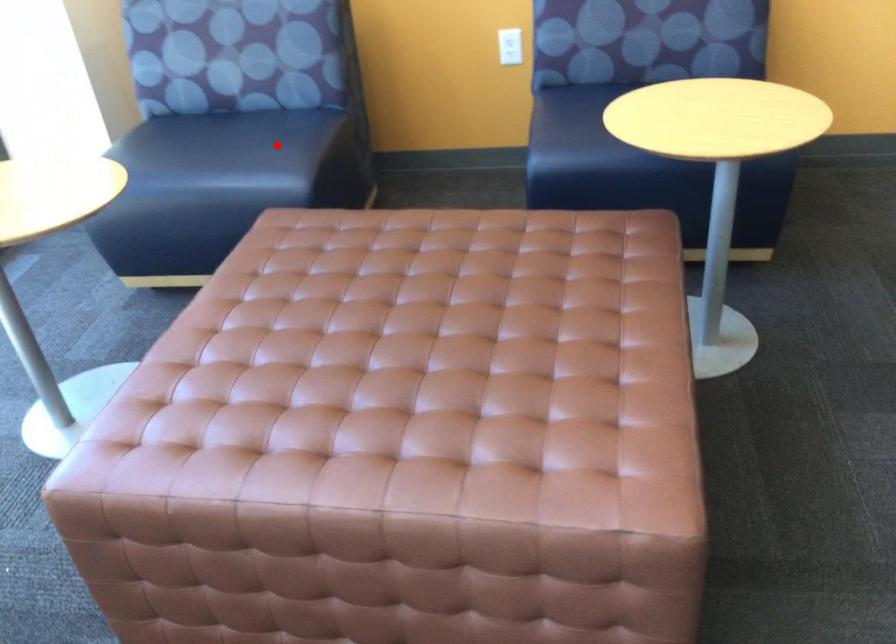
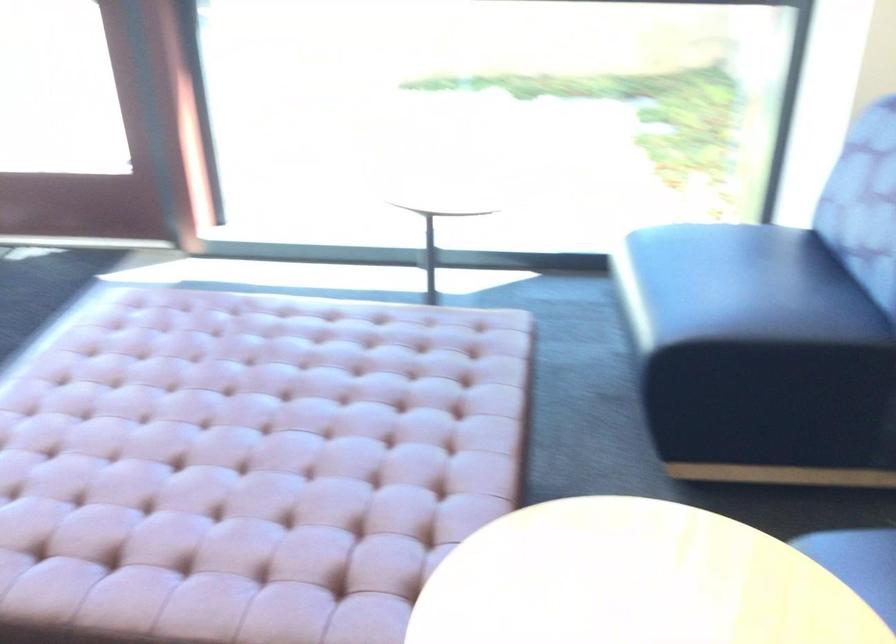
The point at the highlighted location is marked in the first image. Where is the corresponding point in the second image?

(724, 301)